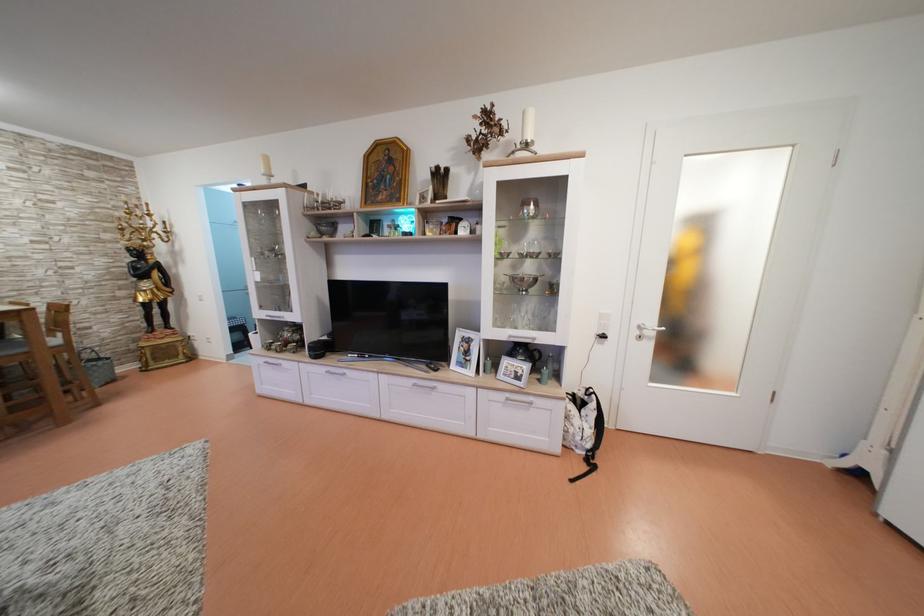
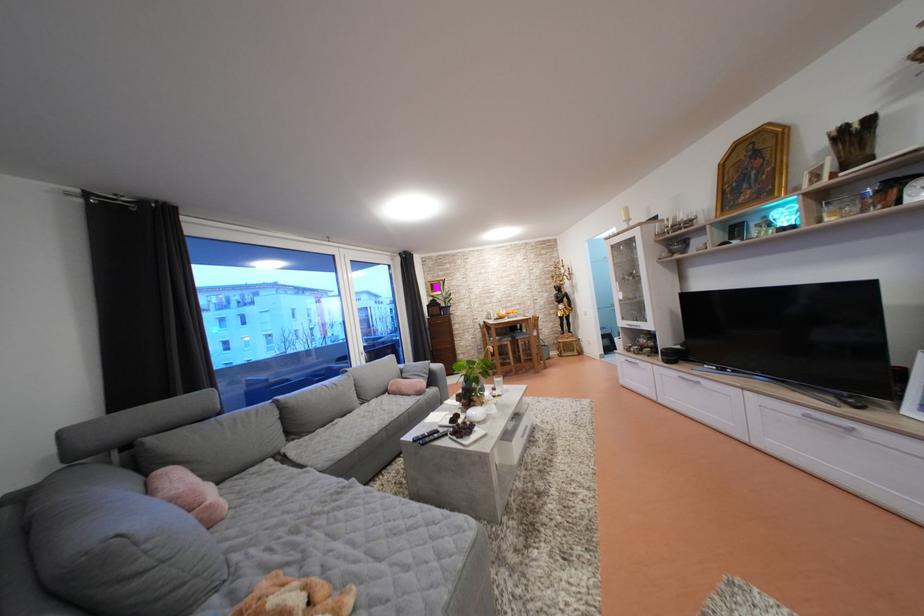
Locate, in the second image, the point that corresponds to (x=335, y=374) in the first image.

(688, 379)